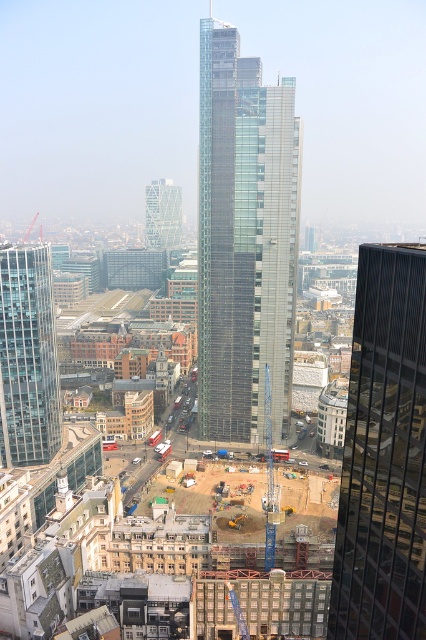
Is transparent glass skyscraper at center smaller than black glass skyscraper at right?

Yes.

Does transparent glass skyscraper at center have a greater width compared to black glass skyscraper at right?

No.

The width and height of the screenshot is (426, 640). I want to click on transparent glass skyscraper at center, so click(x=244, y=240).

The width and height of the screenshot is (426, 640). What are the coordinates of `transparent glass skyscraper at center` in the screenshot? It's located at (244, 240).

Locate an element on the screen. The height and width of the screenshot is (640, 426). transparent glass skyscraper at center is located at coordinates (244, 240).

Does transparent glass skyscraper at center have a greater width compared to translucent glass tower at center?

Yes.

Is point (273, 403) closer to camera compared to point (164, 244)?

Yes, point (273, 403) is in front of point (164, 244).

Identify the location of transparent glass skyscraper at center. The image size is (426, 640). (244, 240).

Can you confirm if black glass skyscraper at right is bigger than transparent glass skyscraper at left?

Correct, black glass skyscraper at right is larger in size than transparent glass skyscraper at left.

Does black glass skyscraper at right have a greater height compared to transparent glass skyscraper at left?

Indeed, black glass skyscraper at right has a greater height compared to transparent glass skyscraper at left.

Is point (377, 428) closer to camera compared to point (51, 412)?

Yes.

The width and height of the screenshot is (426, 640). What are the coordinates of `black glass skyscraper at right` in the screenshot? It's located at (383, 454).